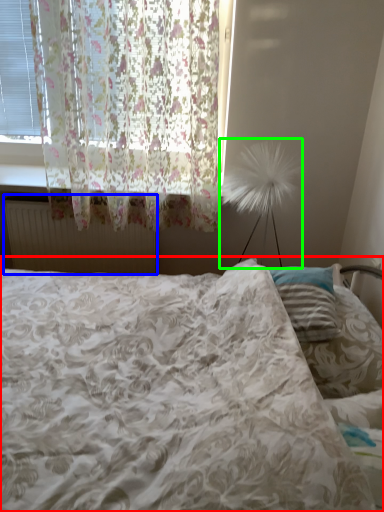
Question: Which object is positioned farthest from bed (highlighted by a red box)? Select from radiator (highlighted by a blue box) and table lamp (highlighted by a green box).

Choices:
 (A) radiator
 (B) table lamp

Answer: (B)